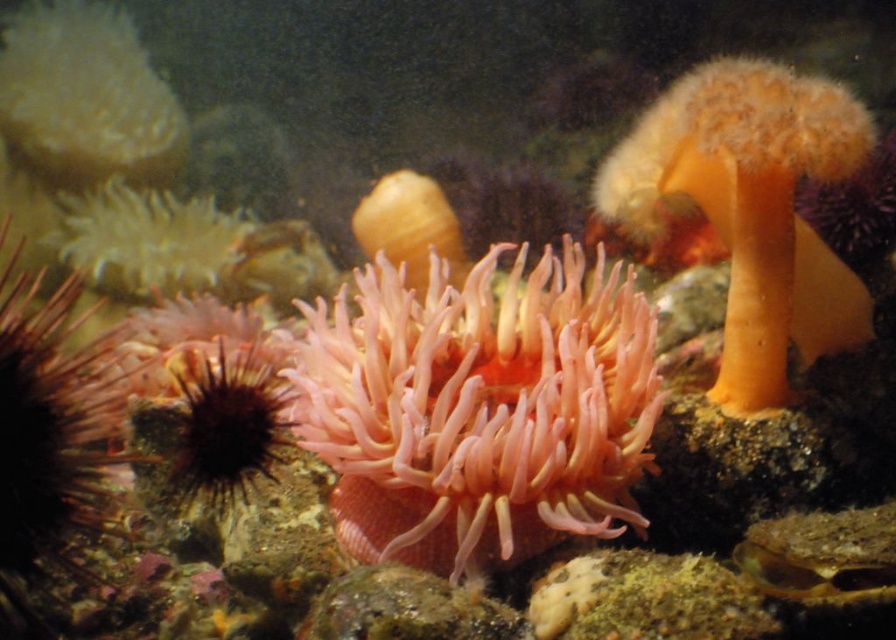
You are a marine biologist observing this underwater scene. You notice the fuzzy yellow sponge at upper left and the translucent yellowish coral at center. Which of these two objects is positioned more to the left side of the image?

The fuzzy yellow sponge at upper left is positioned more to the left side of the image than the translucent yellowish coral at center.

You are a marine biologist studying underwater structures. You observe the pink soft coral at center in an underwater scene. What are its coordinates?

The pink soft coral at center is located at coordinates point (478, 408).

You are a marine biologist observing an underwater scene. You notice the pink soft coral at center and the fuzzy yellow sponge at upper left. Which object is positioned lower in the image?

The pink soft coral at center is positioned below the fuzzy yellow sponge at upper left, so it is the lower object.